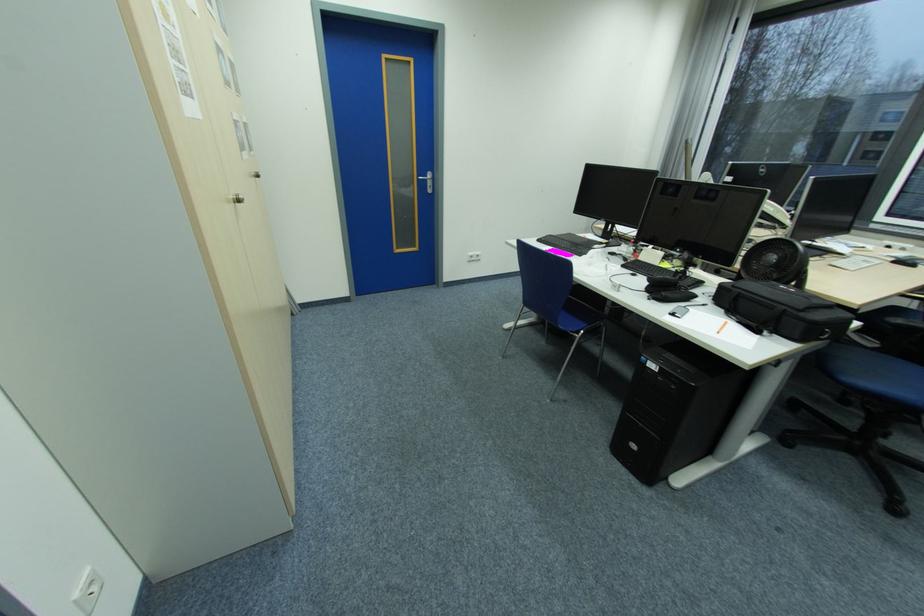
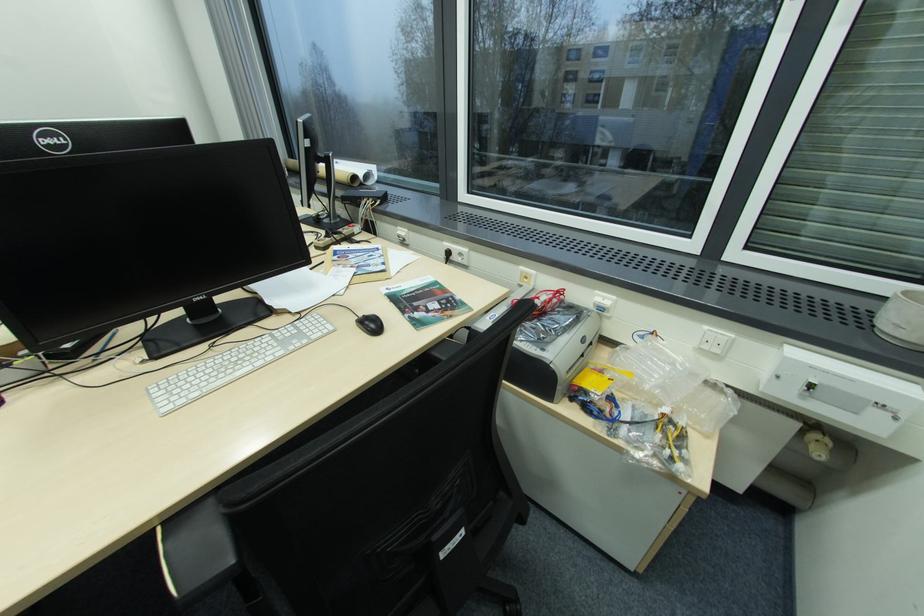
The images are taken continuously from a first-person perspective. In which direction are you moving?

The cameraman moved toward right, forward.